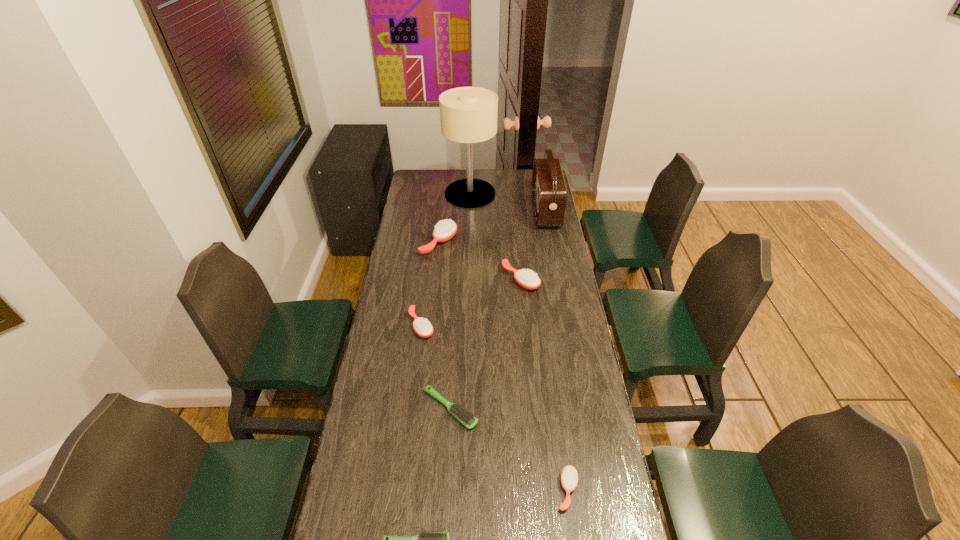
This screenshot has height=540, width=960. What are the coordinates of `free spot between the beige table lamp and the fourth nearest hairbrush` in the screenshot? It's located at point(445,260).

The image size is (960, 540). Identify the location of free space that is in between the farthest orange hairbrush and the fourth nearest object. (430, 284).

Where is `unoccupied position between the beige table lamp and the farthest orange hairbrush`? This screenshot has width=960, height=540. unoccupied position between the beige table lamp and the farthest orange hairbrush is located at coordinates (454, 218).

Find the location of a particular element. This screenshot has width=960, height=540. free spot between the seventh shortest object and the third nearest hairbrush is located at coordinates tap(498, 310).

Image resolution: width=960 pixels, height=540 pixels. I want to click on the second closest object to the radio receiver, so click(529, 280).

Where is `the closest object relative to the radio receiver`? the closest object relative to the radio receiver is located at coordinates (468, 115).

Identify which hairbrush is located as the nearest to the fifth nearest object. Please provide its 2D coordinates. Your answer should be formatted as a tuple, i.e. [(x, y)], where the tuple contains the x and y coordinates of a point satisfying the conditions above.

[(444, 230)]

Point out which hairbrush is positioned as the nearest to the nearest hairbrush. Please provide its 2D coordinates. Your answer should be formatted as a tuple, i.e. [(x, y)], where the tuple contains the x and y coordinates of a point satisfying the conditions above.

[(461, 414)]

Locate which orange hairbrush is the closest to the third tallest hairbrush. Please provide its 2D coordinates. Your answer should be formatted as a tuple, i.e. [(x, y)], where the tuple contains the x and y coordinates of a point satisfying the conditions above.

[(529, 280)]

This screenshot has height=540, width=960. Find the location of `orange hairbrush that is the third closest to the seventh shortest object`. orange hairbrush that is the third closest to the seventh shortest object is located at coordinates (423, 328).